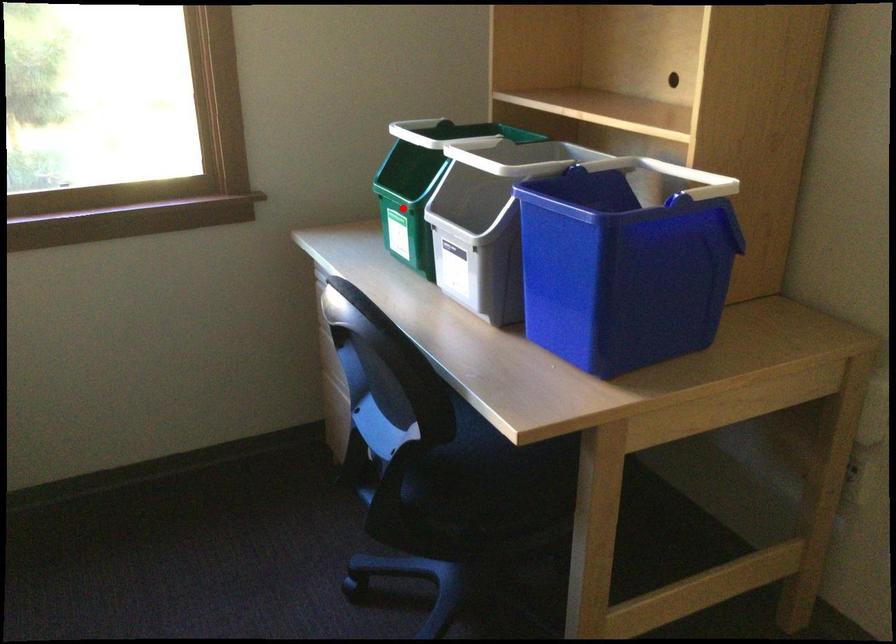
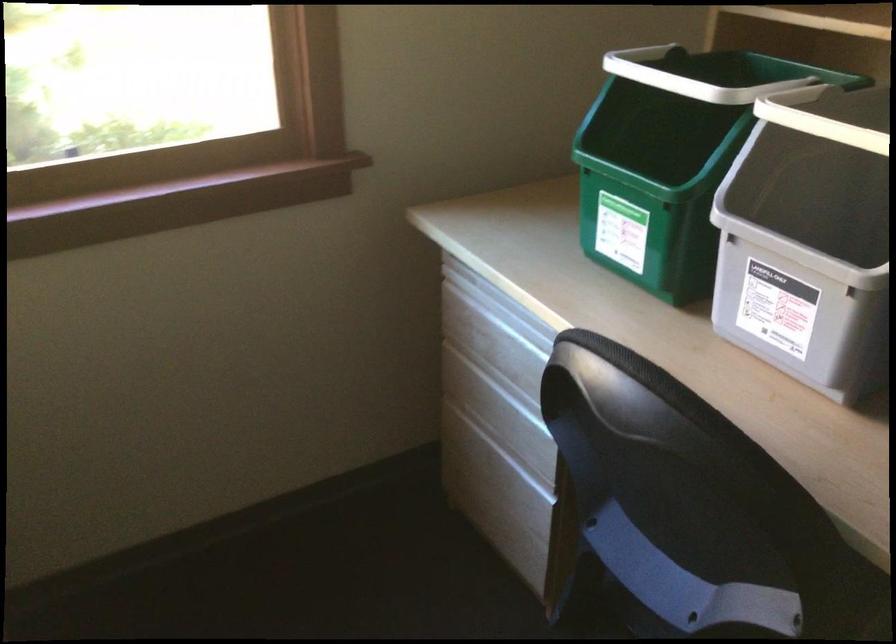
Question: I am providing you with two images of the same scene from different viewpoints. A red point is marked on the first image. At the location where the point appears in image 1, is it still visible in image 2?

Choices:
 (A) Yes
 (B) No

Answer: (A)